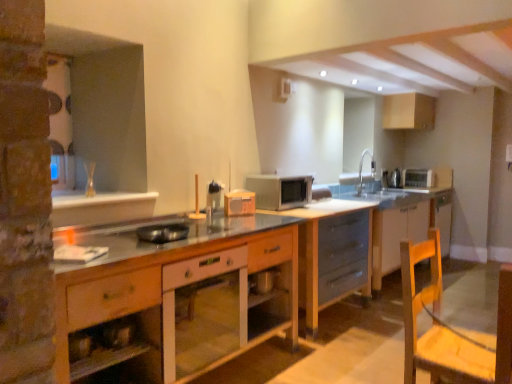
The image size is (512, 384). I want to click on metallic silver toaster at upper right, positioned as the 2th appliance in back-to-front order, so click(x=395, y=178).

The image size is (512, 384). Describe the element at coordinates (332, 253) in the screenshot. I see `matte gray cabinet at center, positioned as the third cabinetry in left-to-right order` at that location.

Locate an element on the screen. The height and width of the screenshot is (384, 512). wooden cabinet at center, which ranks as the fourth cabinetry in right-to-left order is located at coordinates (176, 298).

What are the coordinates of `wooden swivel chair at lower right` in the screenshot? It's located at (440, 326).

Considering the points (426, 362) and (288, 220), which point is in front, point (426, 362) or point (288, 220)?

The point (426, 362) is more forward.

Based on the photo, considering their positions, is wooden swivel chair at lower right located in front of or behind wooden cabinet at center, the first cabinetry when ordered from left to right?

wooden swivel chair at lower right is behind wooden cabinet at center, the first cabinetry when ordered from left to right.

Does wooden swivel chair at lower right appear on the left side of wooden cabinet at center, acting as the 4th cabinetry starting from the back?

No.

From a real-world perspective, who is located lower, silver metallic faucet at upper right or wooden swivel chair at lower right?

wooden swivel chair at lower right, from a real-world perspective.

Which is closer to the camera, (359, 171) or (407, 342)?

Point (359, 171) is positioned farther from the camera compared to point (407, 342).

Can you confirm if silver metallic faucet at upper right is thinner than wooden swivel chair at lower right?

Indeed, silver metallic faucet at upper right has a lesser width compared to wooden swivel chair at lower right.

Measure the distance from silver metallic faucet at upper right to wooden swivel chair at lower right.

→ silver metallic faucet at upper right is 3.89 meters away from wooden swivel chair at lower right.

How far apart are silver metallic faucet at upper right and metallic silver pan at center, acting as the fourth appliance starting from the right?

silver metallic faucet at upper right is 3.97 meters away from metallic silver pan at center, acting as the fourth appliance starting from the right.

How different are the orientations of silver metallic faucet at upper right and metallic silver pan at center, the 1th appliance positioned from the front, in degrees?

silver metallic faucet at upper right and metallic silver pan at center, the 1th appliance positioned from the front, are facing 41.1 degrees away from each other.

Can you confirm if silver metallic faucet at upper right is shorter than metallic silver pan at center, which is the fourth appliance from back to front?

No.

Based on their positions, is silver metallic faucet at upper right located to the left or right of metallic silver pan at center, the first appliance from the left?

silver metallic faucet at upper right is to the right of metallic silver pan at center, the first appliance from the left.

From the image's perspective, is white glossy cabinet at center, acting as the 3th cabinetry starting from the right, positioned above or below metallic silver toaster at upper right, positioned as the 2th appliance in back-to-front order?

From the image's perspective, white glossy cabinet at center, acting as the 3th cabinetry starting from the right, appears below metallic silver toaster at upper right, positioned as the 2th appliance in back-to-front order.

What's the angular difference between white glossy cabinet at center, acting as the 2th cabinetry starting from the front, and metallic silver toaster at upper right, the third appliance in the left-to-right sequence,'s facing directions?

The angle between the facing direction of white glossy cabinet at center, acting as the 2th cabinetry starting from the front, and the facing direction of metallic silver toaster at upper right, the third appliance in the left-to-right sequence, is 37.6 degrees.

Would you say white glossy cabinet at center, arranged as the 2th cabinetry when viewed from the left, is outside metallic silver toaster at upper right, the third appliance from the front?

white glossy cabinet at center, arranged as the 2th cabinetry when viewed from the left, lies outside metallic silver toaster at upper right, the third appliance from the front,'s area.

Is the depth of white glossy cabinet at center, the third cabinetry from the back, greater than that of metallic silver toaster at upper right, positioned as the 2th appliance in back-to-front order?

No, white glossy cabinet at center, the third cabinetry from the back, is closer to the camera.

Consider the image. From a real-world perspective, is matte white microwave at center, which appears as the 3th appliance when viewed from the back, on top of metallic silver toaster at upper right, placed as the second appliance when sorted from right to left?

Yes, from a real-world perspective, matte white microwave at center, which appears as the 3th appliance when viewed from the back, is above metallic silver toaster at upper right, placed as the second appliance when sorted from right to left.

Looking at this image, who is taller, matte white microwave at center, the third appliance viewed from the right, or metallic silver toaster at upper right, placed as the second appliance when sorted from right to left?

matte white microwave at center, the third appliance viewed from the right, is taller.

Is matte white microwave at center, the 2th appliance when ordered from front to back, smaller than metallic silver toaster at upper right, placed as the second appliance when sorted from right to left?

Yes.

Between white matte exhaust hood at upper center and matte white microwave at center, the 2th appliance when ordered from front to back, which one appears on the right side from the viewer's perspective?

From the viewer's perspective, white matte exhaust hood at upper center appears more on the right side.

Does point (434, 41) appear closer or farther from the camera than point (241, 197)?

Point (434, 41) is closer to the camera than point (241, 197).

From the image's perspective, is white matte exhaust hood at upper center under matte white microwave at center, the third appliance viewed from the right?

Incorrect, from the image's perspective, white matte exhaust hood at upper center is higher than matte white microwave at center, the third appliance viewed from the right.

From the picture: Does white matte exhaust hood at upper center touch matte white microwave at center, the third appliance viewed from the right?

No, white matte exhaust hood at upper center is not with matte white microwave at center, the third appliance viewed from the right.

This screenshot has height=384, width=512. Find the location of `cabinetry that is the 3rd object directly below the matte white cabinet at upper right, the fourth cabinetry viewed from the front (from a real-world perspective)`. cabinetry that is the 3rd object directly below the matte white cabinet at upper right, the fourth cabinetry viewed from the front (from a real-world perspective) is located at coordinates (332, 253).

Which object is closer to the camera taking this photo, matte white cabinet at upper right, the fourth cabinetry viewed from the front, or matte gray cabinet at center, which is counted as the third cabinetry, starting from the front?

matte gray cabinet at center, which is counted as the third cabinetry, starting from the front, is closer to the camera.

From a real-world perspective, is matte white cabinet at upper right, placed as the 1th cabinetry when sorted from right to left, physically above matte gray cabinet at center, positioned as the third cabinetry in left-to-right order?

Yes.

Where is `swivel chair on the right of wooden cabinet at center, the first cabinetry viewed from the front`? swivel chair on the right of wooden cabinet at center, the first cabinetry viewed from the front is located at coordinates (440, 326).

Find the location of a particular element. The width and height of the screenshot is (512, 384). faucet that appears above the wooden swivel chair at lower right (from the image's perspective) is located at coordinates (362, 169).

Based on their spatial positions, is white glossy cabinet at center, arranged as the 2th cabinetry when viewed from the left, or metallic silver toaster at upper right, placed as the second appliance when sorted from right to left, further from silver metallic faucet at upper right?

Based on the image, white glossy cabinet at center, arranged as the 2th cabinetry when viewed from the left, appears to be further to silver metallic faucet at upper right.

Considering their positions, is matte white cabinet at upper right, placed as the 1th cabinetry when sorted from right to left, positioned further to wooden swivel chair at lower right than silver metallic faucet at upper right?

The object further to wooden swivel chair at lower right is silver metallic faucet at upper right.

Which object lies nearer to the anchor point matte white microwave at center, which appears as the 3th appliance when viewed from the back, white matte exhaust hood at upper center or satin silver microwave at center?

satin silver microwave at center is positioned closer to the anchor matte white microwave at center, which appears as the 3th appliance when viewed from the back.

Looking at the image, which one is located further to silver metallic toaster at upper right, which appears as the 4th appliance when viewed from the left, metallic silver toaster at upper right, the third appliance from the front, or wooden swivel chair at lower right?

The object further to silver metallic toaster at upper right, which appears as the 4th appliance when viewed from the left, is wooden swivel chair at lower right.

Looking at the image, which one is located closer to metallic silver toaster at upper right, positioned as the 2th appliance in back-to-front order, wooden cabinet at center, the first cabinetry when ordered from left to right, or white glossy cabinet at center, the third cabinetry from the back?

Among the two, wooden cabinet at center, the first cabinetry when ordered from left to right, is located nearer to metallic silver toaster at upper right, positioned as the 2th appliance in back-to-front order.

Consider the image. Estimate the real-world distances between objects in this image. Which object is further from matte gray cabinet at center, positioned as the third cabinetry in left-to-right order, white glossy cabinet at center, acting as the 2th cabinetry starting from the front, or metallic silver toaster at upper right, the third appliance from the front?

metallic silver toaster at upper right, the third appliance from the front, lies further to matte gray cabinet at center, positioned as the third cabinetry in left-to-right order, than the other object.

Looking at the image, which one is located further to matte white microwave at center, which appears as the 3th appliance when viewed from the back, matte gray cabinet at center, which is counted as the third cabinetry, starting from the front, or matte white cabinet at upper right, placed as the 1th cabinetry when sorted from right to left?

The object further to matte white microwave at center, which appears as the 3th appliance when viewed from the back, is matte white cabinet at upper right, placed as the 1th cabinetry when sorted from right to left.

Which object lies nearer to the anchor point wooden cabinet at center, which ranks as the fourth cabinetry in right-to-left order, metallic silver toaster at upper right, the third appliance in the left-to-right sequence, or matte white cabinet at upper right, placed as the 1th cabinetry when sorted from right to left?

Among the two, metallic silver toaster at upper right, the third appliance in the left-to-right sequence, is located nearer to wooden cabinet at center, which ranks as the fourth cabinetry in right-to-left order.

In order to click on cabinetry between white matte exhaust hood at upper center and matte white cabinet at upper right, which ranks as the 4th cabinetry in left-to-right order, from front to back in this screenshot , I will do `click(332, 253)`.

Where is `exhaust hood between wooden swivel chair at lower right and silver metallic faucet at upper right from front to back`? exhaust hood between wooden swivel chair at lower right and silver metallic faucet at upper right from front to back is located at coordinates (415, 61).

Locate an element on the screen. cabinetry between white glossy cabinet at center, acting as the 3th cabinetry starting from the right, and satin silver microwave at center from front to back is located at coordinates (332, 253).

Locate an element on the screen. This screenshot has height=384, width=512. exhaust hood between white glossy cabinet at center, the third cabinetry from the back, and matte white cabinet at upper right, which ranks as the 4th cabinetry in left-to-right order, in the front-back direction is located at coordinates (415, 61).